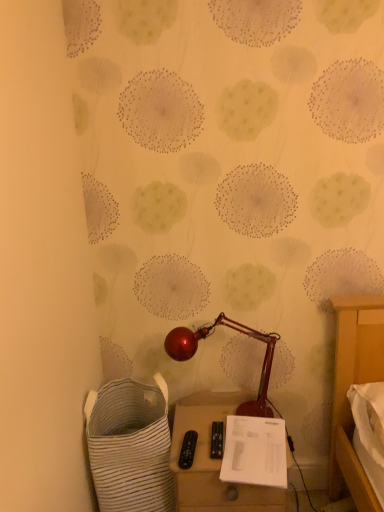
Question: Can you confirm if matte beige side table at lower center is thinner than white paper at lower center?

Choices:
 (A) yes
 (B) no

Answer: (B)

Question: Is matte beige side table at lower center positioned beyond the bounds of white paper at lower center?

Choices:
 (A) no
 (B) yes

Answer: (B)

Question: Is matte beige side table at lower center bigger than white paper at lower center?

Choices:
 (A) no
 (B) yes

Answer: (B)

Question: Is white paper at lower center at the back of matte beige side table at lower center?

Choices:
 (A) yes
 (B) no

Answer: (B)

Question: Is matte beige side table at lower center not near white paper at lower center?

Choices:
 (A) yes
 (B) no

Answer: (B)

Question: Can you confirm if matte beige side table at lower center is positioned to the right of white paper at lower center?

Choices:
 (A) no
 (B) yes

Answer: (A)

Question: Is white paper at lower center next to white striped fabric laundry basket at lower left and touching it?

Choices:
 (A) no
 (B) yes

Answer: (A)

Question: Is white paper at lower center closer to camera compared to white striped fabric laundry basket at lower left?

Choices:
 (A) yes
 (B) no

Answer: (A)

Question: Can you confirm if white paper at lower center is positioned to the left of white striped fabric laundry basket at lower left?

Choices:
 (A) no
 (B) yes

Answer: (A)

Question: Can you confirm if white paper at lower center is shorter than white striped fabric laundry basket at lower left?

Choices:
 (A) yes
 (B) no

Answer: (A)

Question: Is white paper at lower center bigger than white striped fabric laundry basket at lower left?

Choices:
 (A) yes
 (B) no

Answer: (B)

Question: Is white paper at lower center not close to white striped fabric laundry basket at lower left?

Choices:
 (A) no
 (B) yes

Answer: (A)

Question: Considering the relative sizes of white paper at lower center and shiny metallic lamp at center in the image provided, is white paper at lower center taller than shiny metallic lamp at center?

Choices:
 (A) no
 (B) yes

Answer: (A)